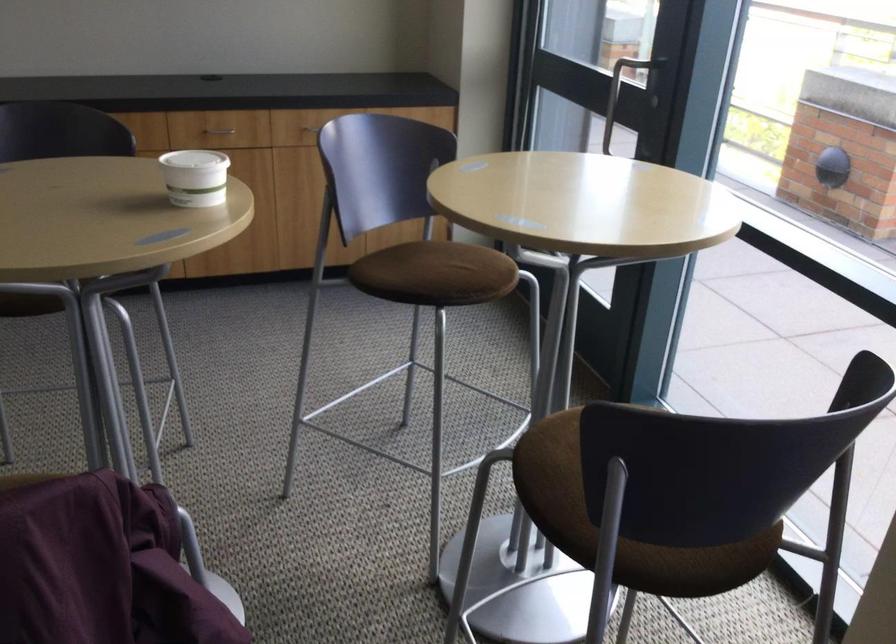
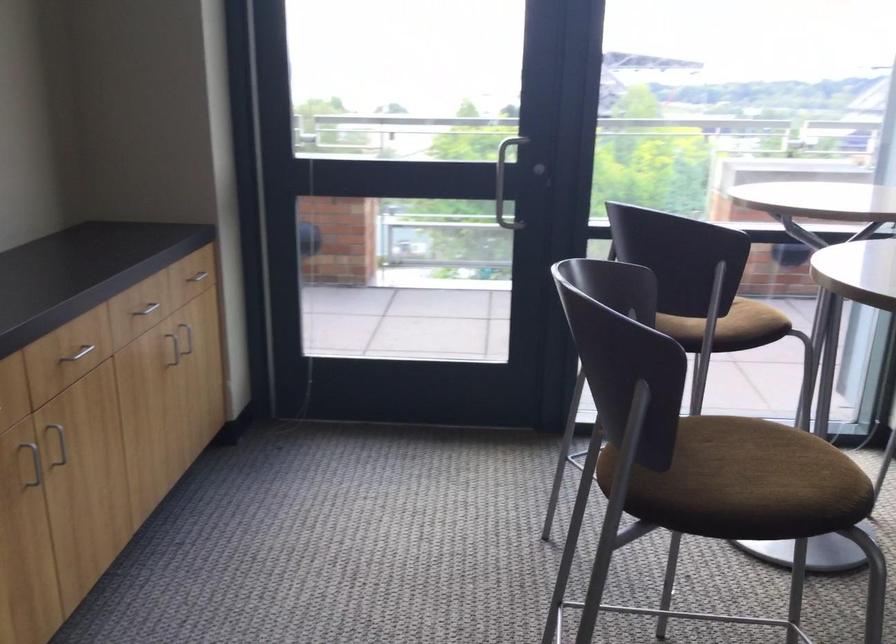
Find the pixel in the second image that matches point (469, 126) in the first image.

(194, 279)